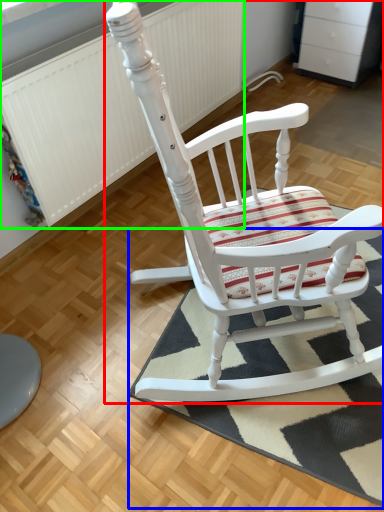
Question: Which object is positioned closest to chair (highlighted by a red box)? Select from doormat (highlighted by a blue box) and radiator (highlighted by a green box).

Choices:
 (A) doormat
 (B) radiator

Answer: (A)